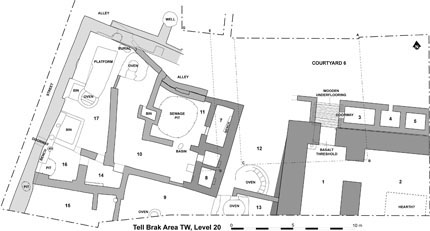
Where is `room 3`? The height and width of the screenshot is (231, 430). room 3 is located at coordinates coord(356,118).